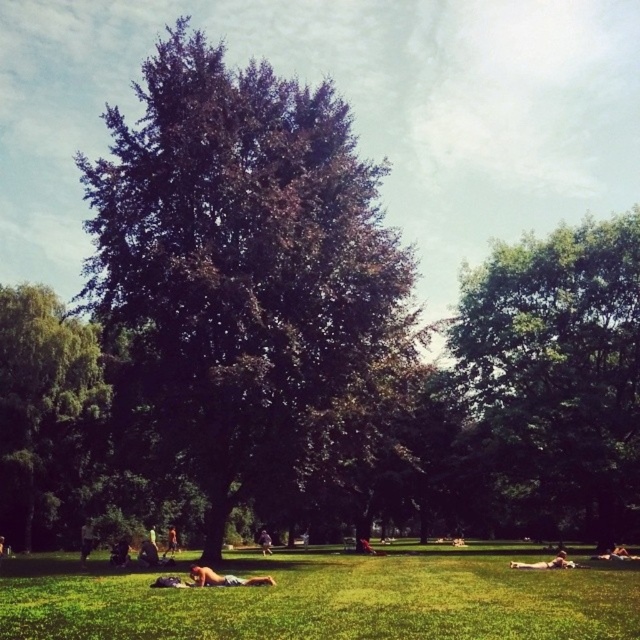
Which is below, green leafy tree at right or brown textured fabric at lower center?

brown textured fabric at lower center is below.

Can you confirm if green leafy tree at right is smaller than brown textured fabric at lower center?

No, green leafy tree at right is not smaller than brown textured fabric at lower center.

Is point (614, 481) less distant than point (156, 557)?

No.

Find the location of a particular element. The height and width of the screenshot is (640, 640). green leafy tree at right is located at coordinates (560, 369).

Between green grass at center and light brown skin at lower right, which one appears on the left side from the viewer's perspective?

From the viewer's perspective, green grass at center appears more on the left side.

Who is shorter, green grass at center or light brown skin at lower right?

light brown skin at lower right

Is point (294, 624) behind point (522, 561)?

No.

Where is `green grass at center`? green grass at center is located at coordinates (324, 600).

Is green leafy tree at left to the left of light brown skin at lower right from the viewer's perspective?

Correct, you'll find green leafy tree at left to the left of light brown skin at lower right.

You are a GUI agent. You are given a task and a screenshot of the screen. Output one action in this format:
    pyautogui.click(x=<x>, y=<y>)
    Task: Click on the green leafy tree at left
    The width and height of the screenshot is (640, 640).
    Given the screenshot: What is the action you would take?
    pyautogui.click(x=44, y=406)